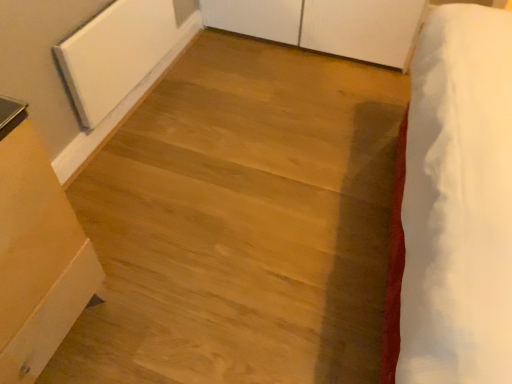
Find the location of a particular element. The width and height of the screenshot is (512, 384). free space to the right of light wood table at left is located at coordinates (151, 305).